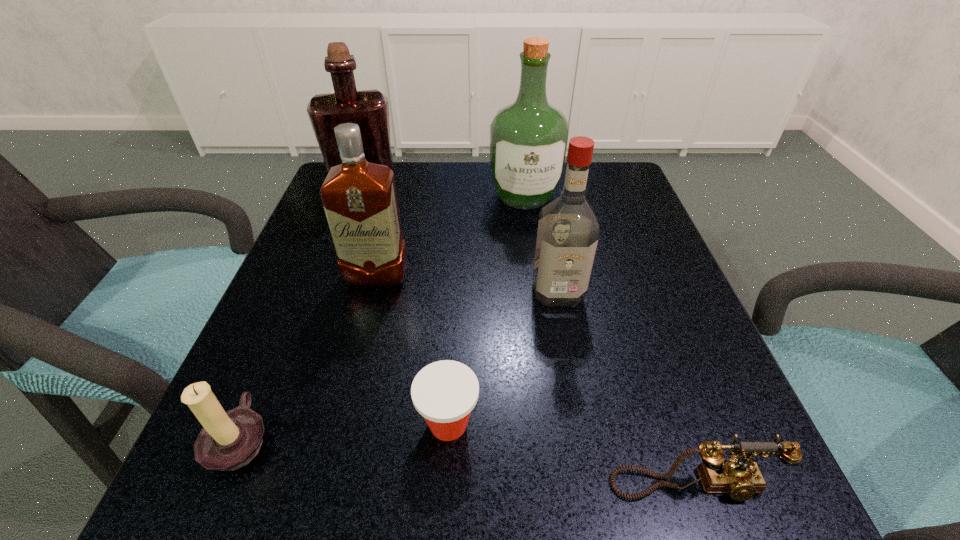
What are the coordinates of `object that is at the far left corner` in the screenshot? It's located at (369, 109).

Find the location of a particular element. This screenshot has height=540, width=960. object that is at the near left corner is located at coordinates (229, 440).

Where is `object that is at the near right corner`? This screenshot has width=960, height=540. object that is at the near right corner is located at coordinates (741, 478).

The width and height of the screenshot is (960, 540). What are the coordinates of `free space at the far edge of the desktop` in the screenshot? It's located at (442, 208).

I want to click on vacant space at the near edge of the desktop, so click(x=577, y=502).

In order to click on free region at the left edge of the desktop in this screenshot , I will do 345,346.

This screenshot has width=960, height=540. I want to click on vacant space at the right edge of the desktop, so (x=631, y=267).

In the image, there is a desktop. Where is `vacant area at the near left corner`? vacant area at the near left corner is located at coordinates (195, 498).

Locate an element on the screen. The width and height of the screenshot is (960, 540). vacant space at the far right corner of the desktop is located at coordinates (597, 204).

The height and width of the screenshot is (540, 960). In order to click on vacant space at the near right corner in this screenshot , I will do `click(750, 501)`.